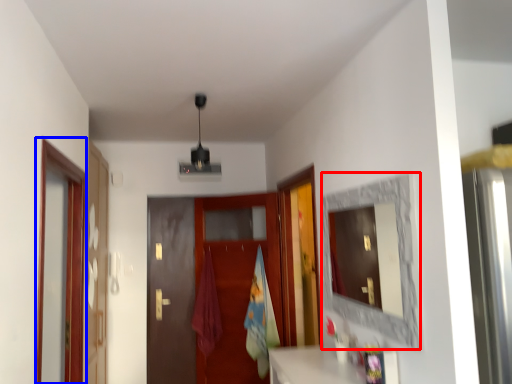
Question: Which point is closer to the camera, mirror (highlighted by a red box) or screen door (highlighted by a blue box)?

Choices:
 (A) mirror
 (B) screen door

Answer: (A)